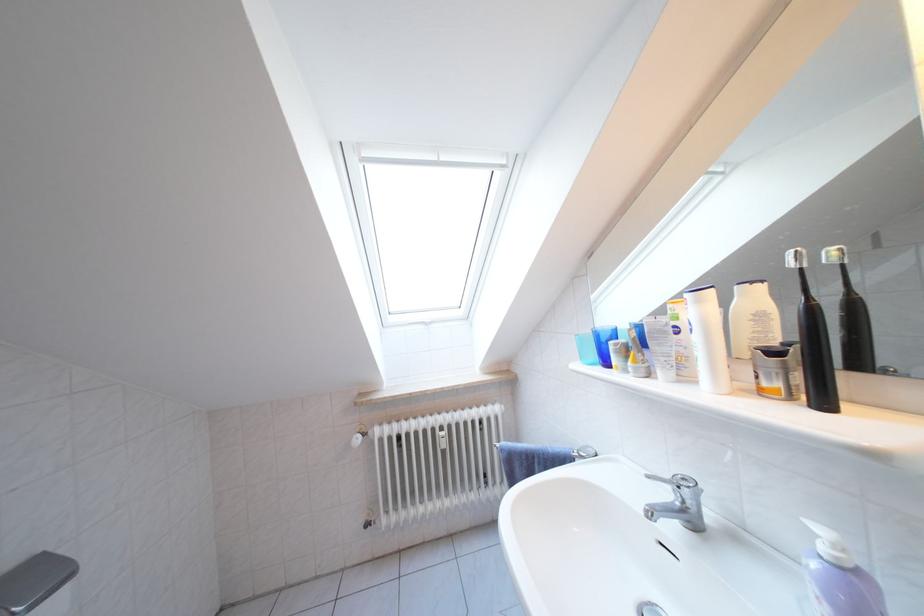
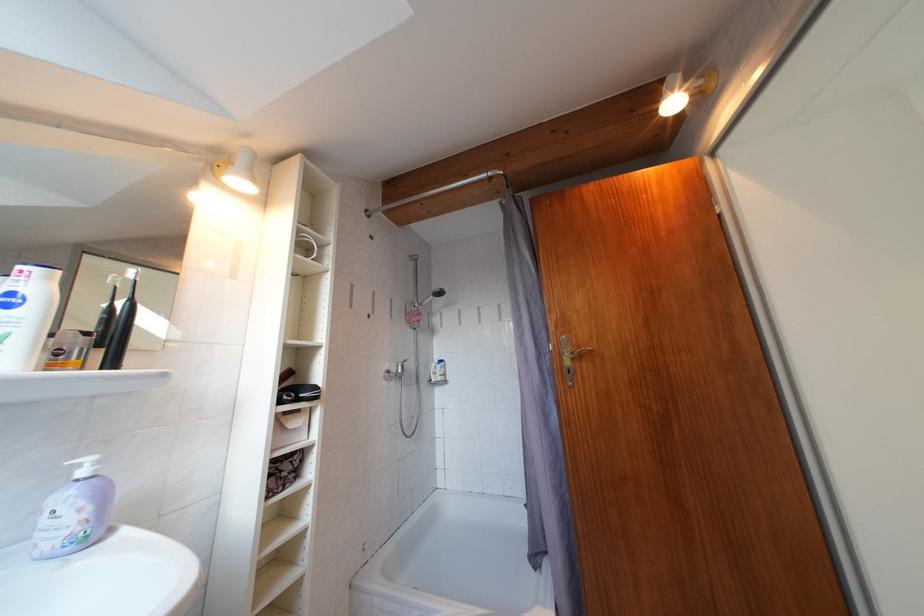
Find the pixel in the second image that matches the point at 832,554 in the first image.

(92, 477)